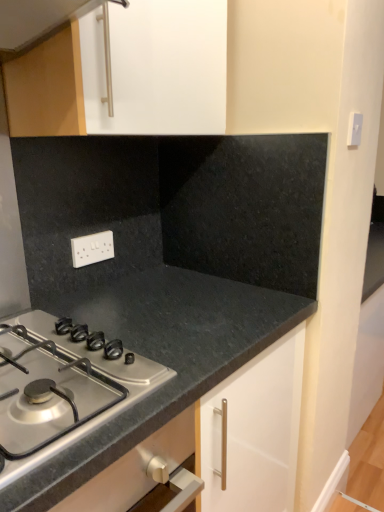
Question: Is black granite countertop at center beside satin silver gas stove at lower left?

Choices:
 (A) yes
 (B) no

Answer: (B)

Question: Does black granite countertop at center have a larger size compared to satin silver gas stove at lower left?

Choices:
 (A) no
 (B) yes

Answer: (B)

Question: Does black granite countertop at center have a lesser height compared to satin silver gas stove at lower left?

Choices:
 (A) no
 (B) yes

Answer: (A)

Question: Is black granite countertop at center positioned before satin silver gas stove at lower left?

Choices:
 (A) no
 (B) yes

Answer: (A)

Question: Is black granite countertop at center wider than satin silver gas stove at lower left?

Choices:
 (A) no
 (B) yes

Answer: (B)

Question: From a real-world perspective, does black granite countertop at center sit lower than satin silver gas stove at lower left?

Choices:
 (A) no
 (B) yes

Answer: (B)

Question: Is satin silver gas stove at lower left facing away from black granite countertop at center?

Choices:
 (A) no
 (B) yes

Answer: (A)

Question: Considering the relative sizes of satin silver gas stove at lower left and black granite countertop at center in the image provided, is satin silver gas stove at lower left taller than black granite countertop at center?

Choices:
 (A) yes
 (B) no

Answer: (B)

Question: Is satin silver gas stove at lower left smaller than black granite countertop at center?

Choices:
 (A) no
 (B) yes

Answer: (B)

Question: Is satin silver gas stove at lower left at the right side of black granite countertop at center?

Choices:
 (A) no
 (B) yes

Answer: (A)

Question: Does satin silver gas stove at lower left come behind black granite countertop at center?

Choices:
 (A) no
 (B) yes

Answer: (A)

Question: Does satin silver gas stove at lower left have a lesser height compared to black granite countertop at center?

Choices:
 (A) yes
 (B) no

Answer: (A)

Question: Is black granite countertop at center taller than white plastic electric outlet at center?

Choices:
 (A) no
 (B) yes

Answer: (B)